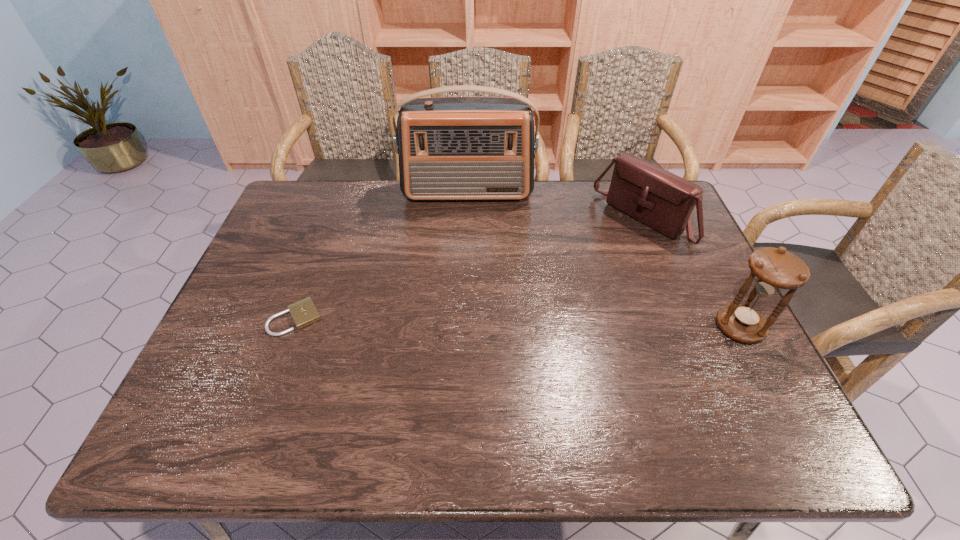
The width and height of the screenshot is (960, 540). In order to click on free space located 0.370m on the front-facing side of the third object from right to left in this screenshot , I will do `click(466, 288)`.

Where is `vacant area situated on the front flap of the shoulder bag`? vacant area situated on the front flap of the shoulder bag is located at coordinates [535, 306].

Find the location of a particular element. The image size is (960, 540). free space located on the front flap of the shoulder bag is located at coordinates (542, 300).

The width and height of the screenshot is (960, 540). What are the coordinates of `free space located on the front flap of the shoulder bag` in the screenshot? It's located at (580, 271).

In order to click on radio receiver situated at the far edge in this screenshot , I will do `click(450, 148)`.

At what (x,y) coordinates should I click in order to perform the action: click on shoulder bag that is at the far edge. Please return your answer as a coordinate pair (x, y). The height and width of the screenshot is (540, 960). Looking at the image, I should click on (663, 201).

Locate an element on the screen. This screenshot has width=960, height=540. object at the left edge is located at coordinates (304, 312).

At what (x,y) coordinates should I click in order to perform the action: click on hourglass situated at the right edge. Please return your answer as a coordinate pair (x, y). The height and width of the screenshot is (540, 960). Looking at the image, I should click on (773, 270).

Locate an element on the screen. The image size is (960, 540). shoulder bag located in the right edge section of the desktop is located at coordinates (663, 201).

The height and width of the screenshot is (540, 960). What are the coordinates of `object situated at the far right corner` in the screenshot? It's located at (663, 201).